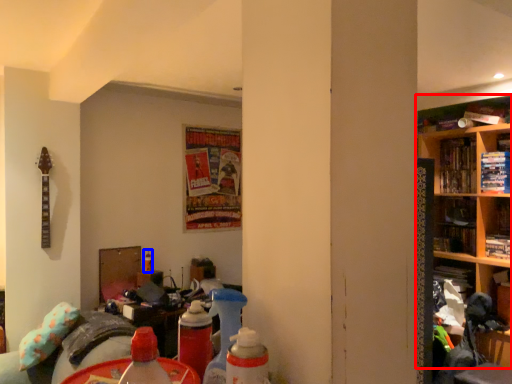
Question: Which object is closer to the camera taking this photo, shelf (highlighted by a red box) or bottle (highlighted by a blue box)?

Choices:
 (A) shelf
 (B) bottle

Answer: (A)